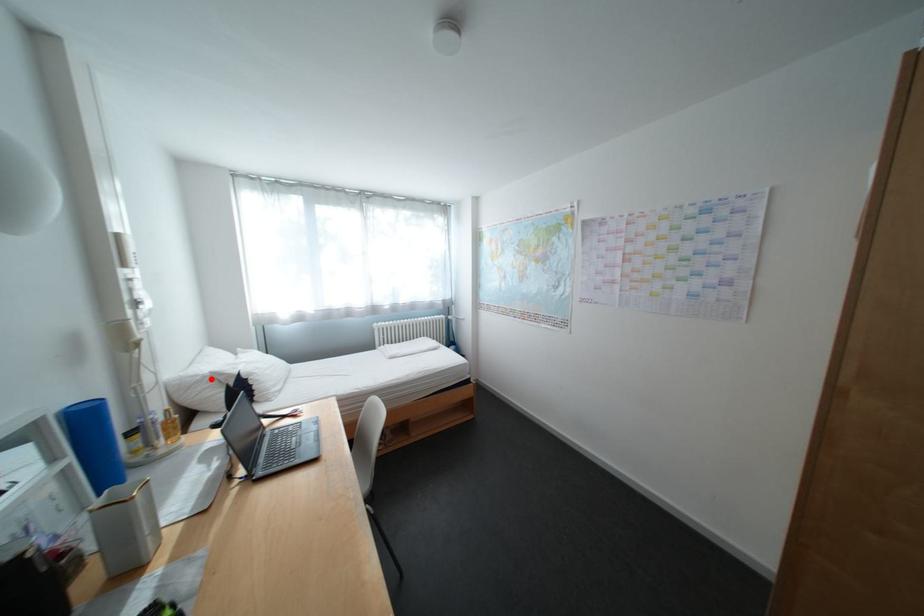
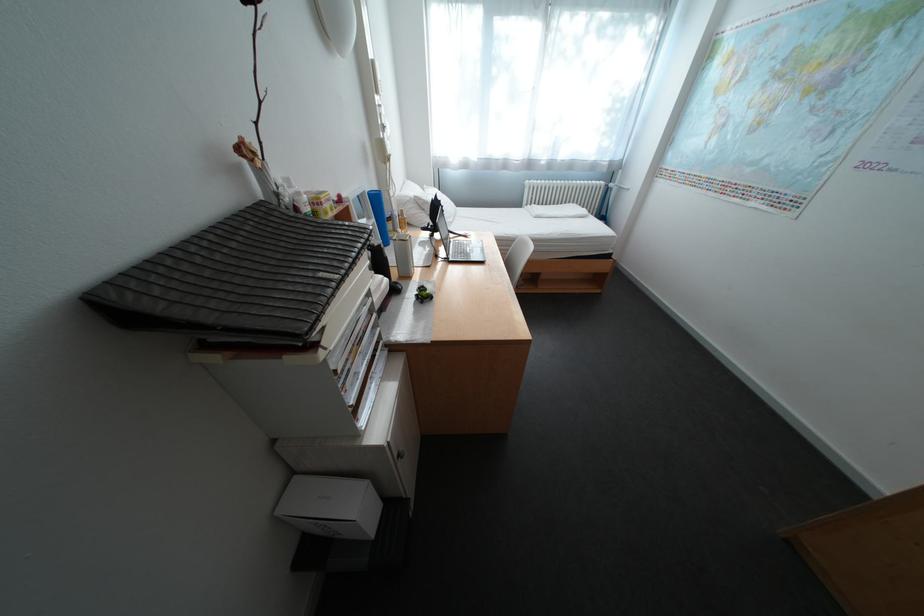
Question: A red point is marked in image1. In image2, is the corresponding 3D point closer to the camera or farther? Reply with the corresponding letter.

Choices:
 (A) The corresponding 3D point is closer.
 (B) The corresponding 3D point is farther.

Answer: (A)